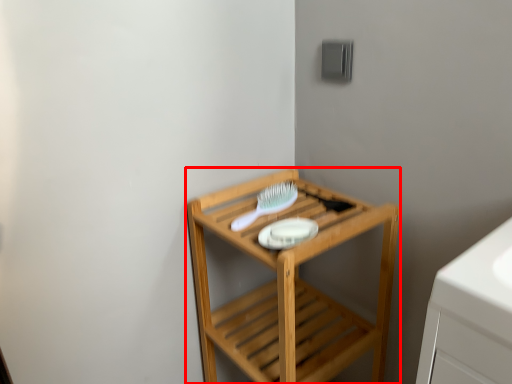
Question: From the image, what is the correct spatial relationship of furniture (annotated by the red box) in relation to brush?

Choices:
 (A) right
 (B) left

Answer: (A)